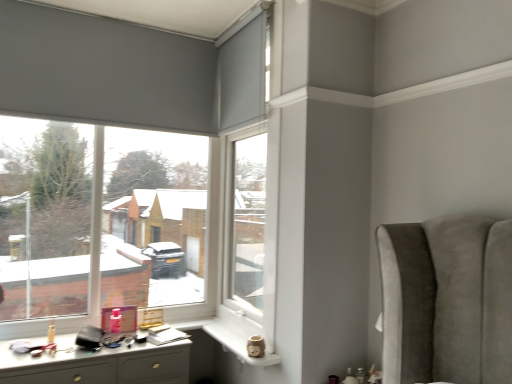
Describe the element at coordinates (248, 189) in the screenshot. I see `white plastic window frame at center` at that location.

Measure the distance between matte gray roller blind at left and camera.

A distance of 2.41 meters exists between matte gray roller blind at left and camera.

Describe the element at coordinates (237, 344) in the screenshot. The image size is (512, 384). I see `white ceramic mug at lower center` at that location.

Where is `white plastic window frame at center`? white plastic window frame at center is located at coordinates (248, 189).

The height and width of the screenshot is (384, 512). I want to click on window frame behind the white ceramic mug at lower center, so click(x=248, y=189).

In the scene shown: From a real-world perspective, between white ceramic mug at lower center and white plastic window frame at center, who is vertically higher?

From a 3D spatial view, white plastic window frame at center is above.

How many degrees apart are the facing directions of white ceramic mug at lower center and white plastic window frame at center?

white ceramic mug at lower center and white plastic window frame at center are facing 90.4 degrees away from each other.

Between white glossy desk at lower left and white ceramic mug at lower center, which one has larger size?

Bigger between the two is white glossy desk at lower left.

Measure the distance between white glossy desk at lower left and white ceramic mug at lower center.

A distance of 25.44 inches exists between white glossy desk at lower left and white ceramic mug at lower center.

From a real-world perspective, relative to white ceramic mug at lower center, is white glossy desk at lower left vertically above or below?

white glossy desk at lower left is below white ceramic mug at lower center.

Does point (81, 359) come in front of point (243, 227)?

Yes, it is.

Where is `desk below the white plastic window frame at center (from a real-world perspective)`? desk below the white plastic window frame at center (from a real-world perspective) is located at coordinates (100, 366).

Considering the sizes of objects white glossy desk at lower left and white plastic window frame at center in the image provided, who is taller, white glossy desk at lower left or white plastic window frame at center?

white plastic window frame at center.

Is white glossy desk at lower left not inside white plastic window frame at center?

white glossy desk at lower left lies outside white plastic window frame at center's area.

Between point (241, 78) and point (37, 55), which one is positioned behind?

The point (241, 78) is behind.

Does white plastic window frame at center have a lesser height compared to matte gray roller blind at left?

No, white plastic window frame at center is not shorter than matte gray roller blind at left.

From the image's perspective, is white plastic window frame at center positioned above or below matte gray roller blind at left?

white plastic window frame at center is situated lower than matte gray roller blind at left in the image.

Which of these two, white plastic window frame at center or matte gray roller blind at left, is smaller?

white plastic window frame at center is smaller.

From the image's perspective, is white plastic window frame at center above or below white ceramic mug at lower center?

Clearly, from the image's perspective, white plastic window frame at center is above white ceramic mug at lower center.

Is white plastic window frame at center turned away from white ceramic mug at lower center?

No, white plastic window frame at center's orientation is not away from white ceramic mug at lower center.

From a real-world perspective, is white plastic window frame at center on top of white ceramic mug at lower center?

Yes, from a real-world perspective, white plastic window frame at center is over white ceramic mug at lower center

Where is `window sill on the left of white plastic window frame at center`? The width and height of the screenshot is (512, 384). window sill on the left of white plastic window frame at center is located at coordinates (237, 344).

From a real-world perspective, does matte gray roller blind at left stand above white glossy desk at lower left?

Yes, from a real-world perspective, matte gray roller blind at left is over white glossy desk at lower left

Could white glossy desk at lower left be considered to be inside matte gray roller blind at left?

Definitely not — white glossy desk at lower left is not inside matte gray roller blind at left.

This screenshot has width=512, height=384. Find the location of `window that appears behind the white glossy desk at lower left`. window that appears behind the white glossy desk at lower left is located at coordinates (123, 73).

Which is less distant, (x=168, y=62) or (x=73, y=370)?

The point (x=73, y=370) is more forward.

How many degrees apart are the facing directions of white ceramic mug at lower center and white glossy desk at lower left?

The angle between the facing direction of white ceramic mug at lower center and the facing direction of white glossy desk at lower left is 0.815 degrees.

Which is more to the right, white ceramic mug at lower center or white glossy desk at lower left?

Positioned to the right is white ceramic mug at lower center.

Is white ceramic mug at lower center thinner than white glossy desk at lower left?

No.

The image size is (512, 384). Find the location of `window sill that appears below the white plastic window frame at center (from a real-world perspective)`. window sill that appears below the white plastic window frame at center (from a real-world perspective) is located at coordinates (237, 344).

Where is `window sill behind the white glossy desk at lower left`? The height and width of the screenshot is (384, 512). window sill behind the white glossy desk at lower left is located at coordinates (237, 344).

Based on the photo, which object lies further to the anchor point white ceramic mug at lower center, matte gray roller blind at left or white glossy desk at lower left?

Based on the image, matte gray roller blind at left appears to be further to white ceramic mug at lower center.

Looking at the image, which one is located closer to white plastic window frame at center, white ceramic mug at lower center or white glossy desk at lower left?

white ceramic mug at lower center.

Which object lies further to the anchor point matte gray roller blind at left, white plastic window frame at center or white ceramic mug at lower center?

The object further to matte gray roller blind at left is white ceramic mug at lower center.

From the image, which object appears to be farther from white glossy desk at lower left, matte gray roller blind at left or white plastic window frame at center?

matte gray roller blind at left.

Based on their spatial positions, is white glossy desk at lower left or matte gray roller blind at left closer to white ceramic mug at lower center?

white glossy desk at lower left lies closer to white ceramic mug at lower center than the other object.

Considering their positions, is white ceramic mug at lower center positioned further to white plastic window frame at center than matte gray roller blind at left?

white ceramic mug at lower center is positioned further to the anchor white plastic window frame at center.

Estimate the real-world distances between objects in this image. Which object is further from white plastic window frame at center, matte gray roller blind at left or white ceramic mug at lower center?

The object further to white plastic window frame at center is white ceramic mug at lower center.

Looking at the image, which one is located further to white plastic window frame at center, white glossy desk at lower left or matte gray roller blind at left?

Based on the image, white glossy desk at lower left appears to be further to white plastic window frame at center.

This screenshot has height=384, width=512. I want to click on window frame between matte gray roller blind at left and white glossy desk at lower left in the vertical direction, so click(x=248, y=189).

Locate an element on the screen. Image resolution: width=512 pixels, height=384 pixels. window frame that lies between matte gray roller blind at left and white ceramic mug at lower center from top to bottom is located at coordinates (248, 189).

The image size is (512, 384). Find the location of `window sill between white plastic window frame at center and white glossy desk at lower left in the vertical direction`. window sill between white plastic window frame at center and white glossy desk at lower left in the vertical direction is located at coordinates (237, 344).

You are a GUI agent. You are given a task and a screenshot of the screen. Output one action in this format:
    pyautogui.click(x=<x>, y=<y>)
    Task: Click on the window sill between matte gray roller blind at left and white glossy desk at lower left in the vertical direction
    The height and width of the screenshot is (384, 512).
    Given the screenshot: What is the action you would take?
    (237, 344)